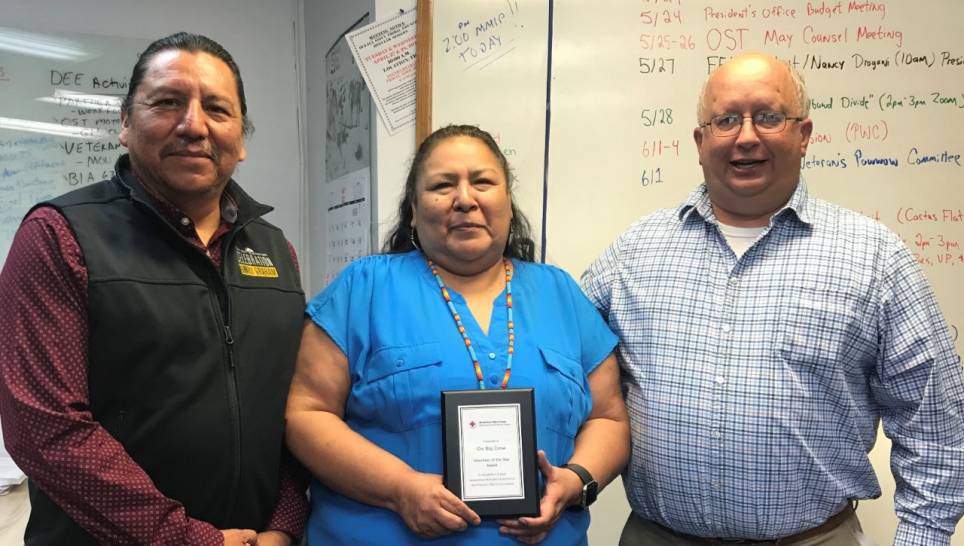
I want to click on whiteboard, so click(573, 115), click(33, 86).